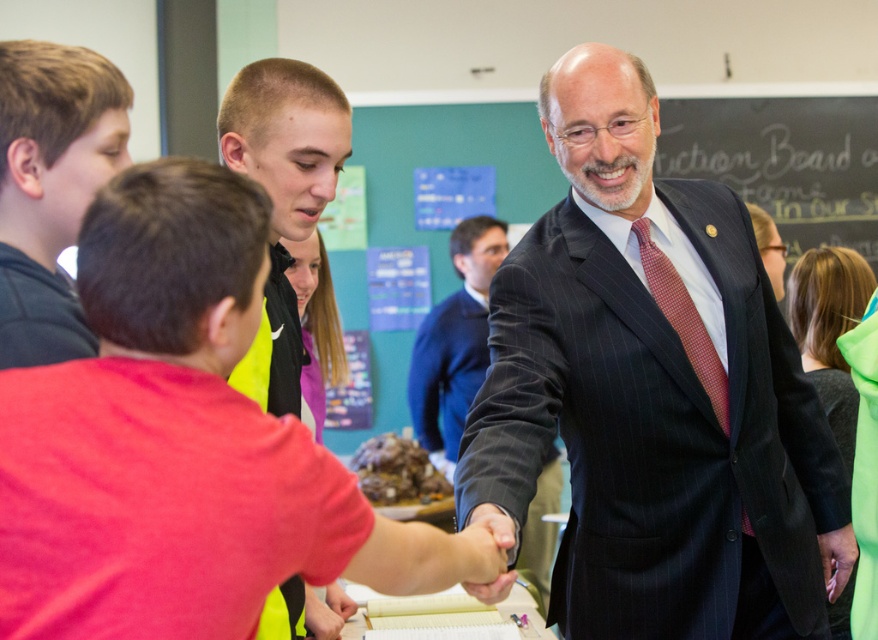
You are a photographer standing 10 feet away from the two people at the center. You want to take a photo of them shaking hands. Can you fit both the short hair at center and the dark blue suit at center in your camera frame if your camera has a maximum horizontal field of view of 8 feet?

The distance between the short hair at center and the dark blue suit at center is 8.48 feet, which exceeds the camera frame of 8 feet. Therefore, you cannot fit both the short hair at center and the dark blue suit at center in the frame.

You are an event photographer trying to capture a clear photo of both the short hair at center and the dark blue suit at center during their handshake. Based on their sizes, which object should you focus on first to ensure it is in frame?

The short hair at center occupies less space than the dark blue suit at center, so you should focus on the short hair at center first to ensure it is in frame before adjusting for the larger dark blue suit at center.